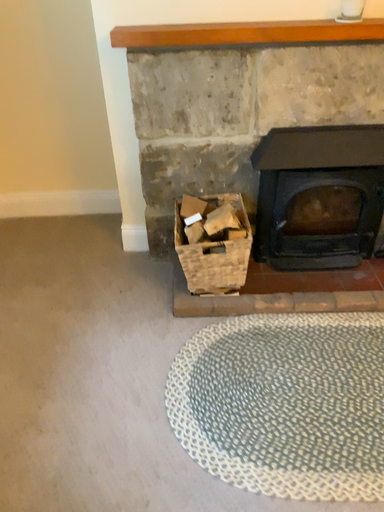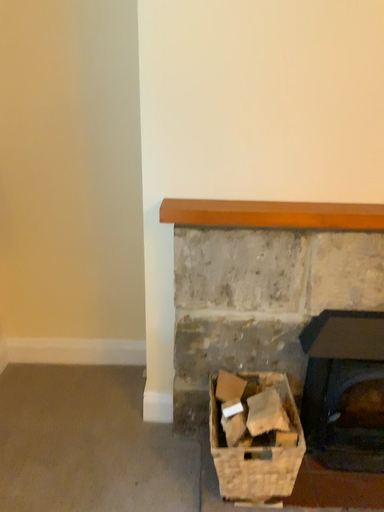
Question: Which way did the camera rotate in the video?

Choices:
 (A) rotated downward
 (B) rotated upward

Answer: (B)